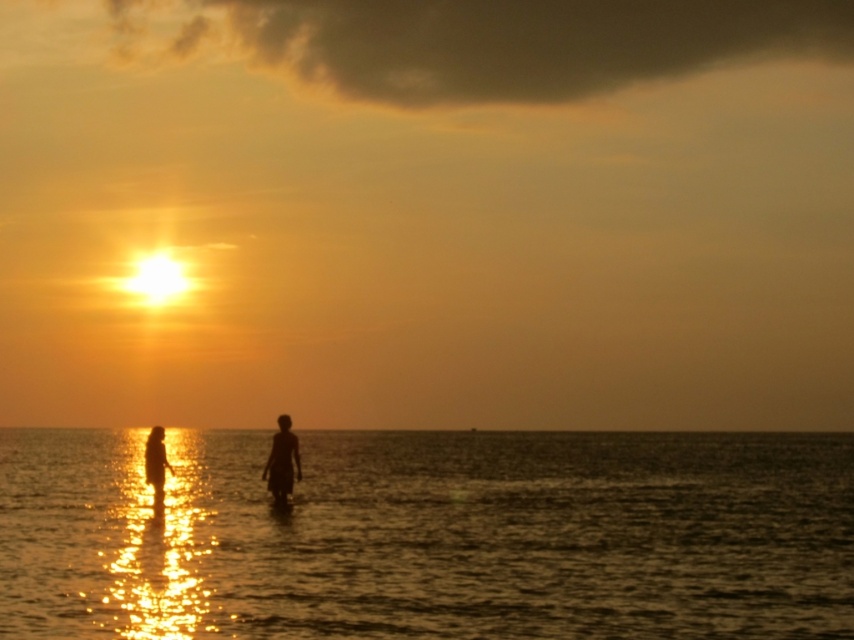
You are standing at the beach watching the sunset and see two points in the water. The first point is labeled as point (794, 444) and the second is point (272, 484). Which point is closer to the shore?

Point (272, 484) is closer to the shore because it is in front of point (794, 444), which is behind it.

You are a photographer trying to capture the sunset scene. You notice the silhouette figure at center in your viewfinder. Based on their position, can you estimate how far they are from the shore compared to the other figure?

The silhouette figure at center is located at point (x=282, y=461), which places them further away from the shore compared to the other figure. Therefore, they are farther out in the water.

Based on the photo, you are a photographer trying to capture the sunset. You notice the shiny reflective water at center and the silhouette figure at center in your viewfinder. Which object takes up more space in the photo?

The shiny reflective water at center takes up more space in the photo because it is larger in size than the silhouette figure at center.